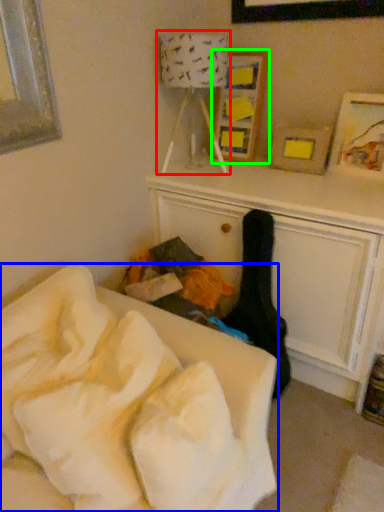
Question: Which object is positioned farthest from lamp (highlighted by a red box)? Select from furniture (highlighted by a blue box) and picture frame (highlighted by a green box).

Choices:
 (A) furniture
 (B) picture frame

Answer: (A)